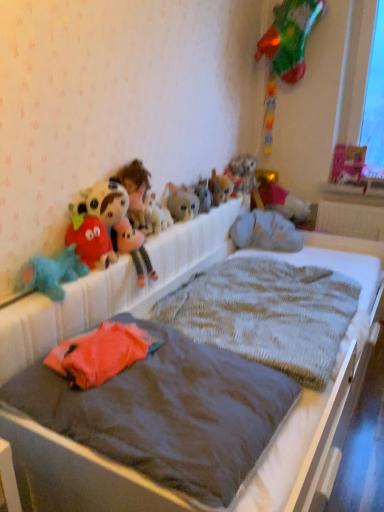
Question: Is red plush strawberry at upper left, which ranks as the 10th toy in right-to-left order, bigger or smaller than soft plush elephant at center, acting as the third toy starting from the right?

Choices:
 (A) small
 (B) big

Answer: (A)

Question: From the image's perspective, is red plush strawberry at upper left, which ranks as the 10th toy in right-to-left order, located above or below soft plush elephant at center, acting as the 9th toy starting from the left?

Choices:
 (A) below
 (B) above

Answer: (A)

Question: Which object is the closest to the soft plush elephant at center, acting as the third toy starting from the right?

Choices:
 (A) fluffy gray stuffed animal at center, which ranks as the 7th toy in left-to-right order
 (B) dark gray fabric mattress at center, which is the second mattress in back-to-front order
 (C) fluffy plush toy at center, acting as the 4th toy starting from the left
 (D) fluffy plush toy at upper center, which ranks as the 3th toy in left-to-right order
 (E) fluffy gray cat at center, arranged as the 5th toy when viewed from the left

Answer: (A)

Question: Estimate the real-world distances between objects in this image. Which object is farther from the red plush strawberry at upper left, which ranks as the 10th toy in right-to-left order?

Choices:
 (A) textured gray blanket at center
 (B) fluffy plush toy at center, acting as the 4th toy starting from the left
 (C) fluffy blue stuffed animal at left, which appears as the eleventh toy when viewed from the right
 (D) gray fabric teddy bear at upper center, which is the 10th toy from left to right
 (E) fluffy plush toy at upper center, which ranks as the 3th toy in left-to-right order

Answer: (D)